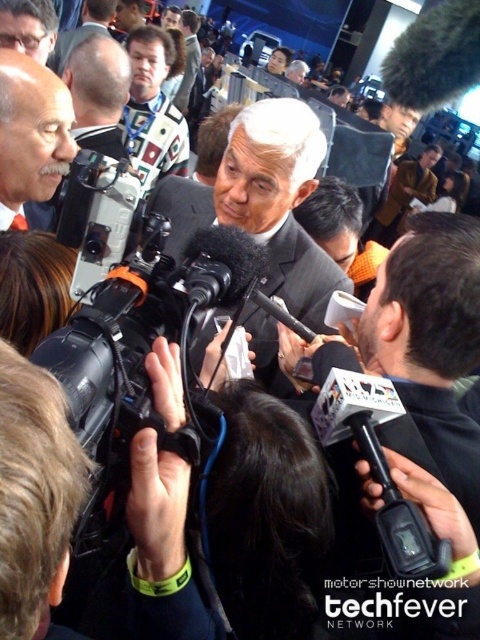
Question: Which point appears closest to the camera in this image?

Choices:
 (A) (132, 45)
 (B) (295, 230)
 (C) (184, 90)
 (D) (34, 35)

Answer: (B)

Question: Does white matte suit at center appear on the right side of light brown suit at center?

Choices:
 (A) yes
 (B) no

Answer: (A)

Question: Considering the real-world distances, which object is farthest from the matte black suit at center?

Choices:
 (A) light brown suit at center
 (B) dark gray suit at center

Answer: (A)

Question: Considering the real-world distances, which object is farthest from the matte black suit at center?

Choices:
 (A) light brown suit at center
 (B) white textured shirt at center
 (C) dark gray suit at center
 (D) white matte suit at center

Answer: (A)

Question: Can you confirm if dark gray suit at center is wider than white matte suit at center?

Choices:
 (A) no
 (B) yes

Answer: (B)

Question: Does white matte suit at center have a lesser width compared to matte black suit at center?

Choices:
 (A) yes
 (B) no

Answer: (B)